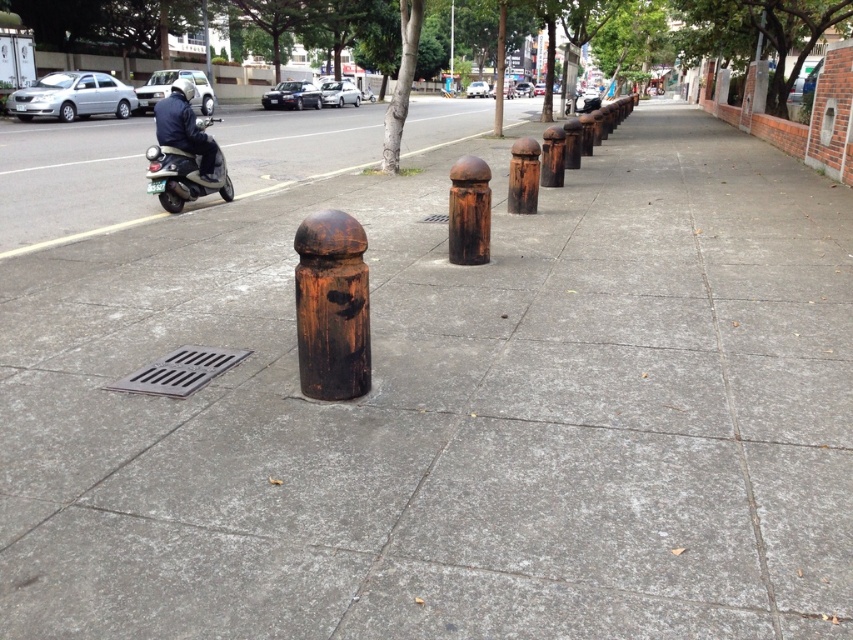
You are a delivery person who needs to place a package between the rusty wood post at center and the rusty metal post at center. Based on their positions, which post should you place the package closer to if you want it to be higher up?

The rusty metal post at center is higher up than the rusty wood post at center, so you should place the package closer to the rusty metal post at center to have it higher up.

You are standing at the camera position and want to place a 3.5 meter long ladder between yourself and the rusty wood post at center. Can the ladder fit without overlapping the post?

The distance between the camera and the rusty wood post at center is 3.34 meters. Since the ladder is 3.5 meters long, it would be slightly longer than the available space. Therefore, the ladder cannot fit without overlapping the post.